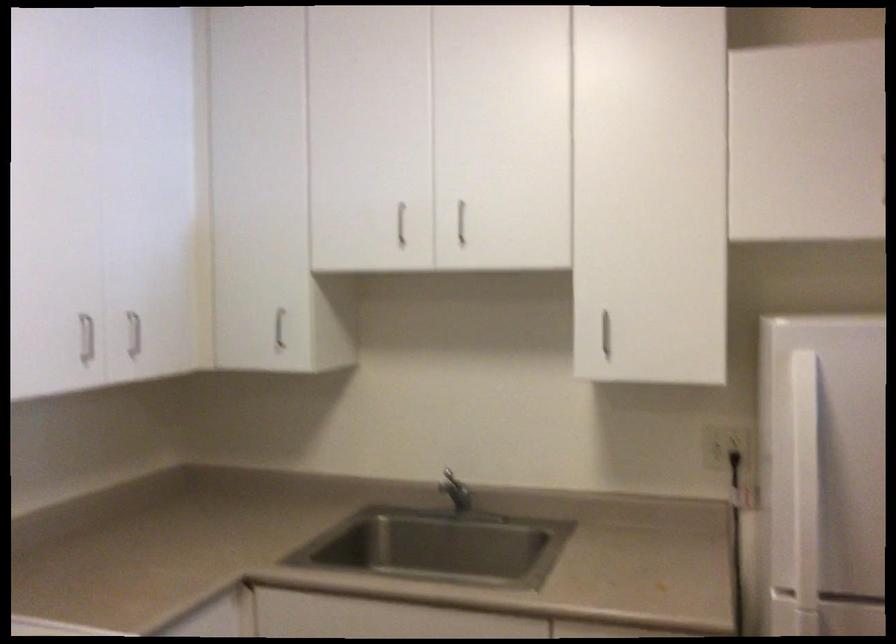
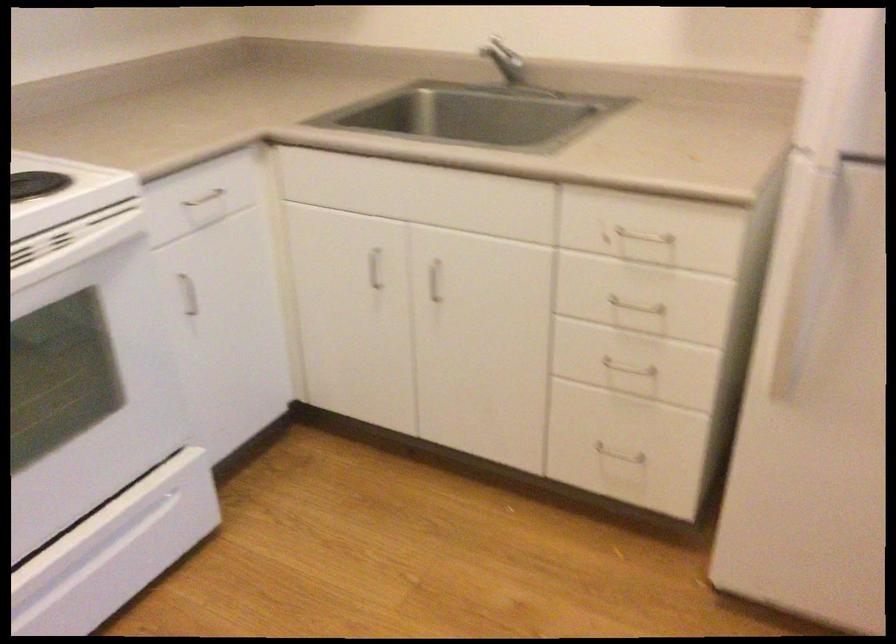
Which direction would the cameraman need to move to produce the second image?

The cameraman moved toward right, forward.